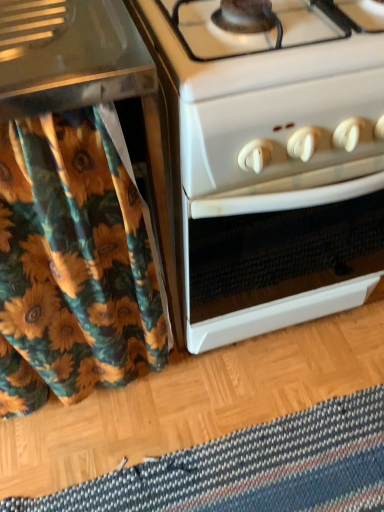
This screenshot has height=512, width=384. I want to click on floral fabric shower curtain at left, so click(71, 265).

What is the approximate width of striped woolen mat at lower center?

It is 10.33 inches.

Find the location of a particular element. This screenshot has width=384, height=512. white glossy oven at center is located at coordinates (270, 160).

Locate an element on the screen. This screenshot has height=512, width=384. floral fabric shower curtain at left is located at coordinates (71, 265).

What are the coordinates of `mat on the left of the white glossy oven at center` in the screenshot? It's located at (252, 468).

Considering the sizes of striped woolen mat at lower center and white glossy oven at center in the image, is striped woolen mat at lower center bigger or smaller than white glossy oven at center?

Clearly, striped woolen mat at lower center is smaller in size than white glossy oven at center.

How different are the orientations of striped woolen mat at lower center and white glossy oven at center in degrees?

The angular difference between striped woolen mat at lower center and white glossy oven at center is 1.28 degrees.

From a real-world perspective, which is physically above, striped woolen mat at lower center or white glossy oven at center?

white glossy oven at center is physically above.

Could striped woolen mat at lower center be considered to be inside floral fabric shower curtain at left?

No, striped woolen mat at lower center is not a part of floral fabric shower curtain at left.

Where is `shower curtain that appears on the left of striped woolen mat at lower center`? shower curtain that appears on the left of striped woolen mat at lower center is located at coordinates (71, 265).

Does floral fabric shower curtain at left appear on the left side of striped woolen mat at lower center?

Yes.

Is floral fabric shower curtain at left facing towards striped woolen mat at lower center?

Yes, floral fabric shower curtain at left is oriented towards striped woolen mat at lower center.

From the image's perspective, is striped woolen mat at lower center on floral fabric shower curtain at left?

No, from the image's perspective, striped woolen mat at lower center is not on top of floral fabric shower curtain at left.

Is striped woolen mat at lower center at the right side of floral fabric shower curtain at left?

Yes.

Is striped woolen mat at lower center inside or outside of floral fabric shower curtain at left?

striped woolen mat at lower center lies outside floral fabric shower curtain at left.

Can you tell me how much striped woolen mat at lower center and floral fabric shower curtain at left differ in facing direction?

There is a 0.849-degree angle between the facing directions of striped woolen mat at lower center and floral fabric shower curtain at left.

Which object is thinner, white glossy oven at center or floral fabric shower curtain at left?

With smaller width is floral fabric shower curtain at left.

Does white glossy oven at center appear on the right side of floral fabric shower curtain at left?

Yes.

Does white glossy oven at center have a lesser height compared to floral fabric shower curtain at left?

Correct, white glossy oven at center is not as tall as floral fabric shower curtain at left.

Is point (218, 119) in front of point (102, 480)?

Yes, it is.

Can you see white glossy oven at center touching striped woolen mat at lower center?

No.

From their relative heights in the image, would you say white glossy oven at center is taller or shorter than striped woolen mat at lower center?

In the image, white glossy oven at center appears to be taller than striped woolen mat at lower center.

Between white glossy oven at center and striped woolen mat at lower center, which one has larger width?

white glossy oven at center.

Is floral fabric shower curtain at left closer to the viewer compared to white glossy oven at center?

Yes, floral fabric shower curtain at left is closer to the camera.

Could you tell me if floral fabric shower curtain at left is facing white glossy oven at center?

No, floral fabric shower curtain at left is not aimed at white glossy oven at center.

Is floral fabric shower curtain at left wider or thinner than white glossy oven at center?

Considering their sizes, floral fabric shower curtain at left looks slimmer than white glossy oven at center.

Can you confirm if floral fabric shower curtain at left is bigger than white glossy oven at center?

Actually, floral fabric shower curtain at left might be smaller than white glossy oven at center.

In order to click on oven above the striped woolen mat at lower center (from the image's perspective) in this screenshot , I will do `click(270, 160)`.

Identify the location of shower curtain in front of the striped woolen mat at lower center. (71, 265).

Estimate the real-world distances between objects in this image. Which object is further from striped woolen mat at lower center, white glossy oven at center or floral fabric shower curtain at left?

white glossy oven at center is further to striped woolen mat at lower center.

Based on their spatial positions, is striped woolen mat at lower center or floral fabric shower curtain at left closer to white glossy oven at center?

The object closer to white glossy oven at center is floral fabric shower curtain at left.

From the image, which object appears to be nearer to floral fabric shower curtain at left, white glossy oven at center or striped woolen mat at lower center?

The object closer to floral fabric shower curtain at left is white glossy oven at center.

Which object lies further to the anchor point striped woolen mat at lower center, floral fabric shower curtain at left or white glossy oven at center?

white glossy oven at center lies further to striped woolen mat at lower center than the other object.

Based on the photo, considering their positions, is striped woolen mat at lower center positioned further to floral fabric shower curtain at left than white glossy oven at center?

striped woolen mat at lower center is positioned further to the anchor floral fabric shower curtain at left.

When comparing their distances from white glossy oven at center, does floral fabric shower curtain at left or striped woolen mat at lower center seem closer?

Among the two, floral fabric shower curtain at left is located nearer to white glossy oven at center.

You are a GUI agent. You are given a task and a screenshot of the screen. Output one action in this format:
    pyautogui.click(x=<x>, y=<y>)
    Task: Click on the shower curtain between white glossy oven at center and striped woolen mat at lower center in the up-down direction
    The width and height of the screenshot is (384, 512).
    Given the screenshot: What is the action you would take?
    pyautogui.click(x=71, y=265)